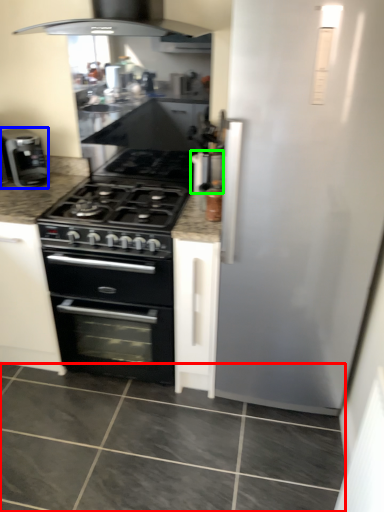
Question: Estimate the real-world distances between objects in this image. Which object is farther from granite (highlighted by a red box), kitchen appliance (highlighted by a blue box) or appliance (highlighted by a green box)?

Choices:
 (A) kitchen appliance
 (B) appliance

Answer: (A)